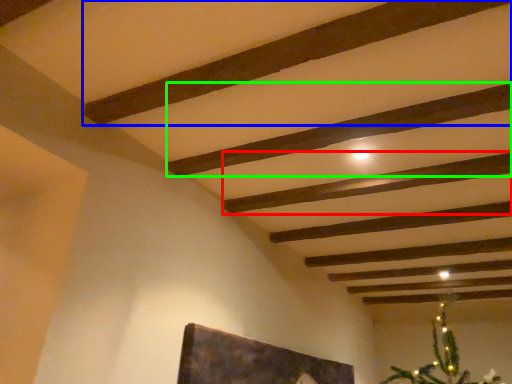
Question: Which is nearer to the plank (highlighted by a red box)? plank (highlighted by a blue box) or plank (highlighted by a green box).

Choices:
 (A) plank
 (B) plank

Answer: (B)